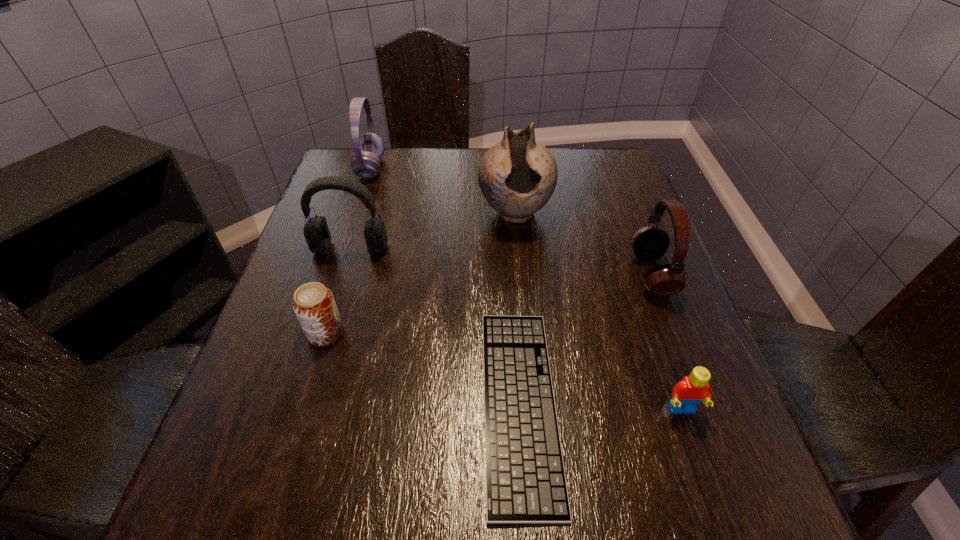
Where is `unoccupied position between the farthest object and the Lego`? unoccupied position between the farthest object and the Lego is located at coordinates (526, 289).

Locate an element on the screen. empty location between the farthest headset and the tallest object is located at coordinates (443, 191).

Identify the location of free spot between the computer keyboard and the beer can. This screenshot has height=540, width=960. (422, 368).

Find the location of a particular element. object that stands as the closest to the computer keyboard is located at coordinates (691, 390).

Locate which object ranks fifth in proximity to the tallest object. Please provide its 2D coordinates. Your answer should be formatted as a tuple, i.e. [(x, y)], where the tuple contains the x and y coordinates of a point satisfying the conditions above.

[(314, 305)]

Locate an element on the screen. Image resolution: width=960 pixels, height=540 pixels. headset that is the second closest to the rightmost headset is located at coordinates (369, 148).

Point out which headset is positioned as the nearest to the tallest object. Please provide its 2D coordinates. Your answer should be formatted as a tuple, i.e. [(x, y)], where the tuple contains the x and y coordinates of a point satisfying the conditions above.

[(649, 243)]

This screenshot has height=540, width=960. I want to click on free space that satisfies the following two spatial constraints: 1. on the front side of the shortest object; 2. on the left side of the beer can, so click(304, 404).

Identify the location of vacant space that satisfies the following two spatial constraints: 1. on the ear pads of the rightmost headset; 2. on the front side of the beer can. This screenshot has height=540, width=960. (675, 333).

Where is `free space that satisfies the following two spatial constraints: 1. on the ear pads of the rightmost headset; 2. on the face of the Lego`? This screenshot has height=540, width=960. free space that satisfies the following two spatial constraints: 1. on the ear pads of the rightmost headset; 2. on the face of the Lego is located at coordinates (704, 410).